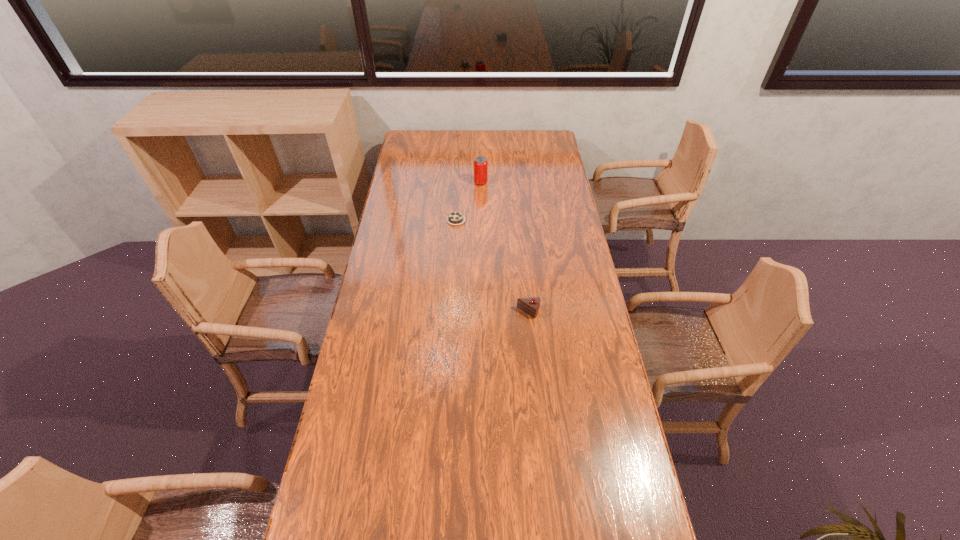
Find the location of `vacant space that satisfies the following two spatial constraints: 1. on the back side of the leftmost object; 2. on the left side of the tallest object`. vacant space that satisfies the following two spatial constraints: 1. on the back side of the leftmost object; 2. on the left side of the tallest object is located at coordinates (459, 183).